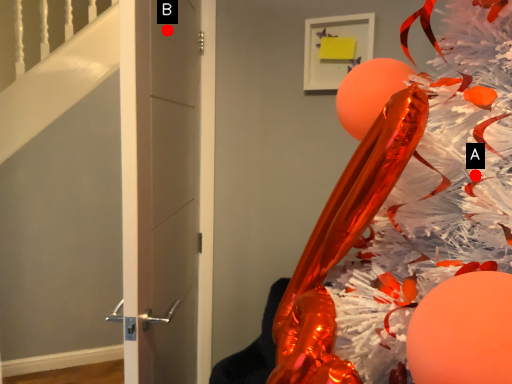
Question: Two points are circled on the image, labeled by A and B beside each circle. Which point appears farthest from the camera in this image?

Choices:
 (A) A is further
 (B) B is further

Answer: (B)